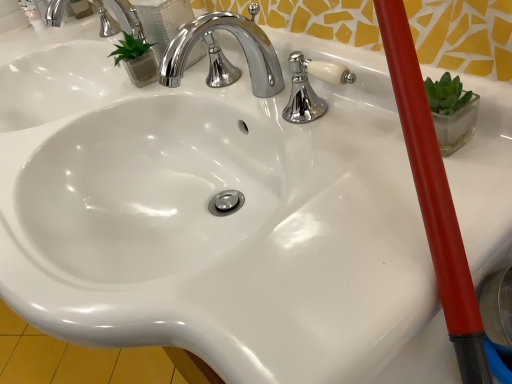
Locate an element on the screen. vacant area to the left of chrome/metallic faucet at center, the first tap when ordered from front to back is located at coordinates (140, 101).